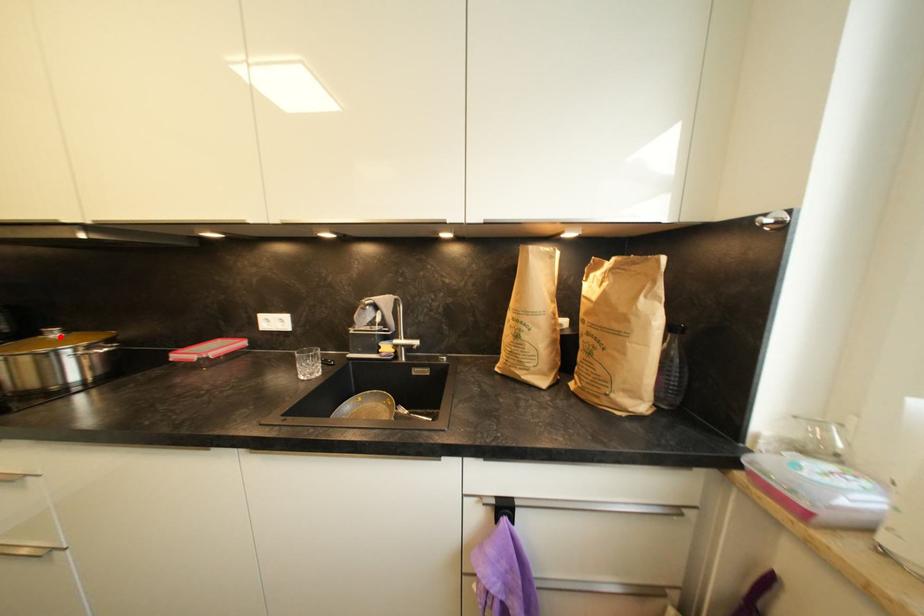
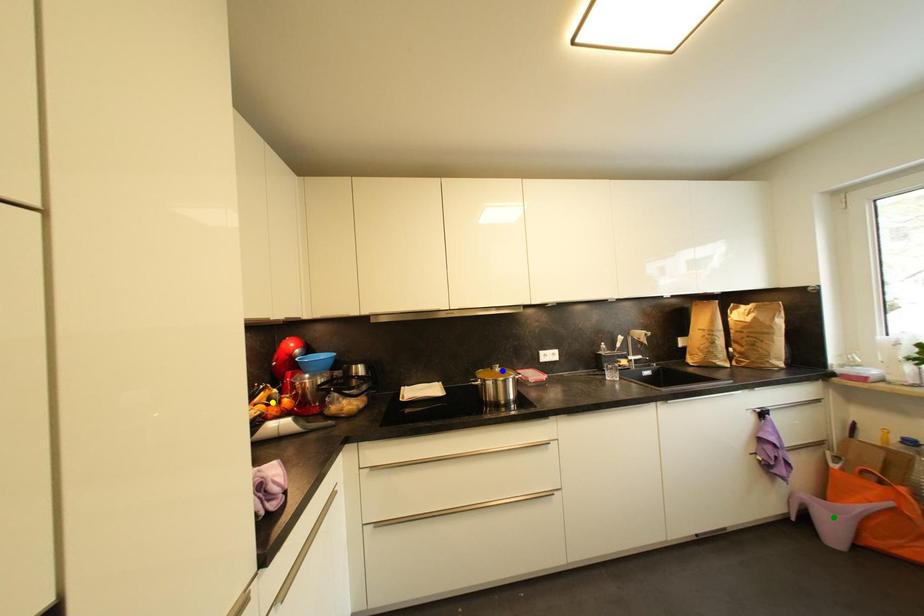
Question: I am providing you with two images of the same scene from different viewpoints. A red point is marked on the first image. You are given multiple points on the second image. In image 2, which mark is for the same physical point as the one in image 1?

Choices:
 (A) yellow point
 (B) green point
 (C) blue point

Answer: (C)